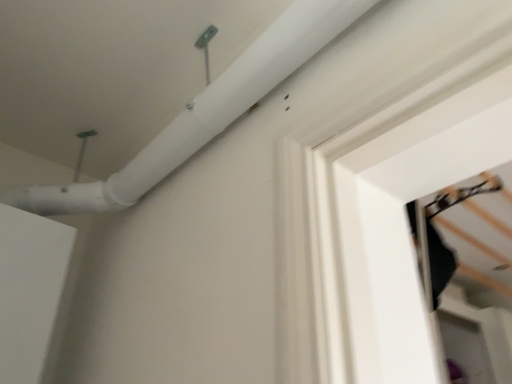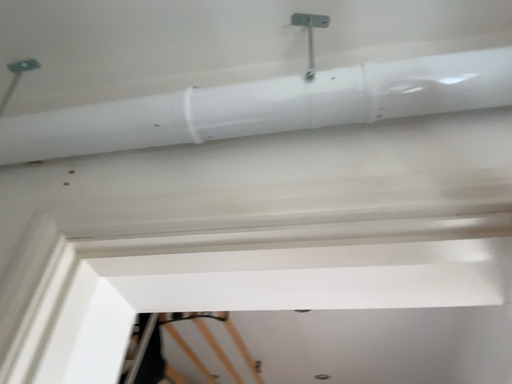
Question: Which way did the camera rotate in the video?

Choices:
 (A) rotated left
 (B) rotated right

Answer: (B)